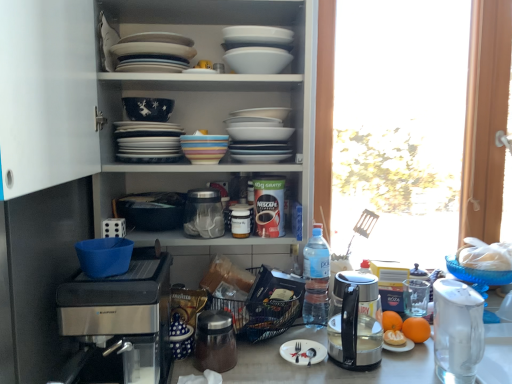
Question: Should I look upward or downward to see multicolored ceramic bowls at center, arranged as the 2th tableware when viewed from the right?

Choices:
 (A) down
 (B) up

Answer: (B)

Question: Does blue plastic bowl at lower left, which is the first bowl in front-to-back order, appear on the left side of satin silver coffee maker at lower left?

Choices:
 (A) yes
 (B) no

Answer: (A)

Question: From the image's perspective, is blue plastic bowl at lower left, the 3th bowl viewed from the back, under satin silver coffee maker at lower left?

Choices:
 (A) no
 (B) yes

Answer: (A)

Question: Is blue plastic bowl at lower left, the 3th bowl when ordered from right to left, located outside satin silver coffee maker at lower left?

Choices:
 (A) yes
 (B) no

Answer: (A)

Question: Considering the relative sizes of blue plastic bowl at lower left, the 3th bowl viewed from the back, and satin silver coffee maker at lower left in the image provided, is blue plastic bowl at lower left, the 3th bowl viewed from the back, shorter than satin silver coffee maker at lower left?

Choices:
 (A) yes
 (B) no

Answer: (A)

Question: Is blue plastic bowl at lower left, placed as the first bowl when sorted from left to right, further to the viewer compared to satin silver coffee maker at lower left?

Choices:
 (A) yes
 (B) no

Answer: (A)

Question: Are blue plastic bowl at lower left, which is the first bowl in front-to-back order, and satin silver coffee maker at lower left located far from each other?

Choices:
 (A) yes
 (B) no

Answer: (B)

Question: Is multicolored ceramic bowls at center, placed as the 2th tableware when sorted from top to bottom, to the left of transparent plastic jar at center from the viewer's perspective?

Choices:
 (A) no
 (B) yes

Answer: (B)

Question: Does multicolored ceramic bowls at center, positioned as the 2th tableware in bottom-to-top order, turn towards transparent plastic jar at center?

Choices:
 (A) no
 (B) yes

Answer: (A)

Question: Considering the relative sizes of multicolored ceramic bowls at center, which is counted as the 2th tableware, starting from the left, and transparent plastic jar at center in the image provided, is multicolored ceramic bowls at center, which is counted as the 2th tableware, starting from the left, bigger than transparent plastic jar at center?

Choices:
 (A) yes
 (B) no

Answer: (B)

Question: Can you confirm if multicolored ceramic bowls at center, placed as the 2th tableware when sorted from top to bottom, is shorter than transparent plastic jar at center?

Choices:
 (A) no
 (B) yes

Answer: (B)

Question: Can you confirm if multicolored ceramic bowls at center, which is counted as the 2th tableware, starting from the left, is wider than transparent plastic jar at center?

Choices:
 (A) no
 (B) yes

Answer: (A)

Question: From the image's perspective, is multicolored ceramic bowls at center, positioned as the 2th tableware in bottom-to-top order, located beneath transparent plastic jar at center?

Choices:
 (A) yes
 (B) no

Answer: (B)

Question: From a real-world perspective, is matte blue bowl at upper center, the 2th bowl viewed from the top, positioned under sleek stainless steel kettle at right based on gravity?

Choices:
 (A) no
 (B) yes

Answer: (A)